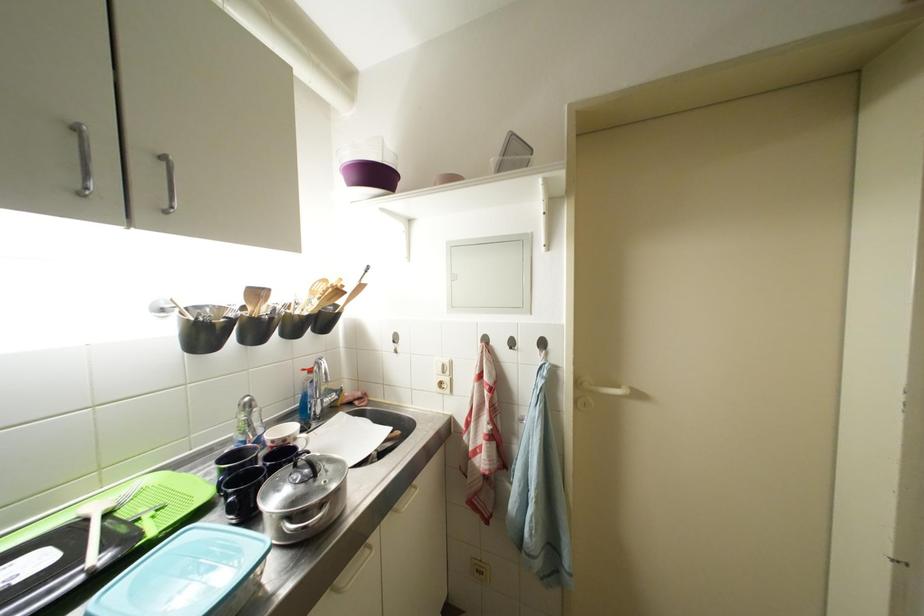
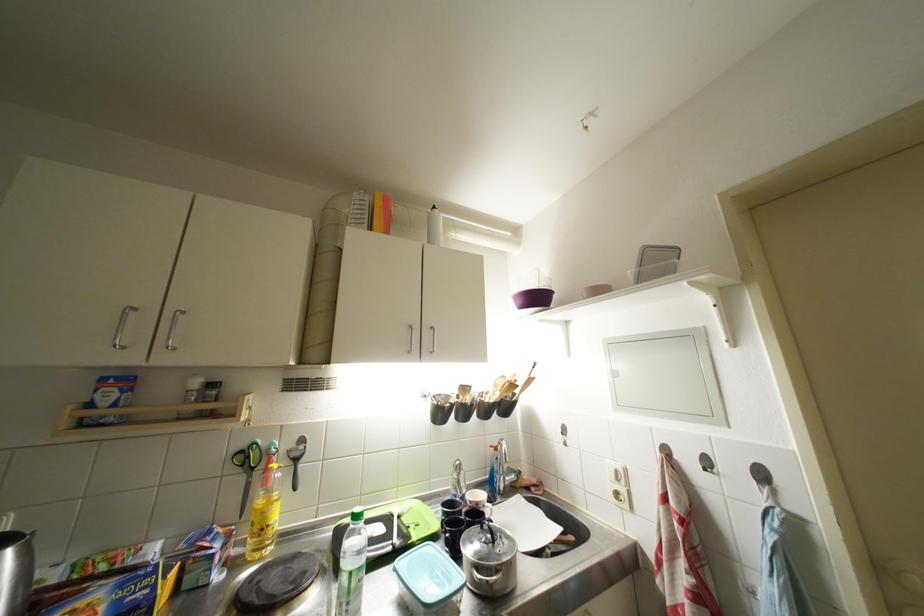
Locate, in the second image, the point that corresponds to the point at 345,296 in the first image.

(519, 390)